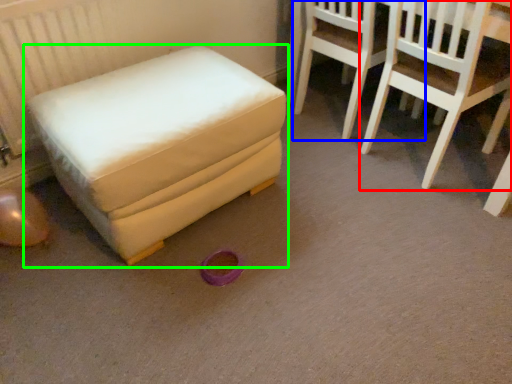
Question: Which is farther away from chair (highlighted by a red box)? chair (highlighted by a blue box) or furniture (highlighted by a green box)?

Choices:
 (A) chair
 (B) furniture

Answer: (B)